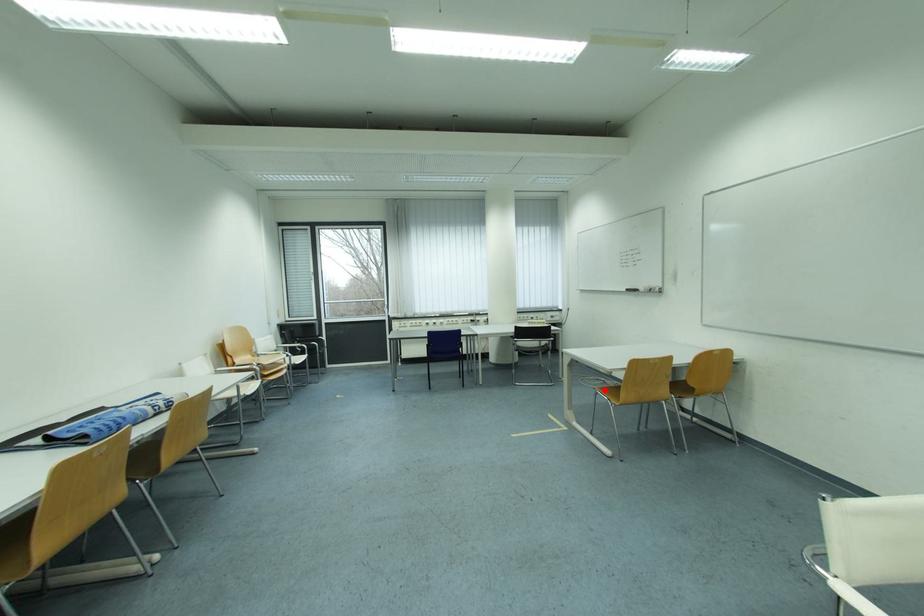
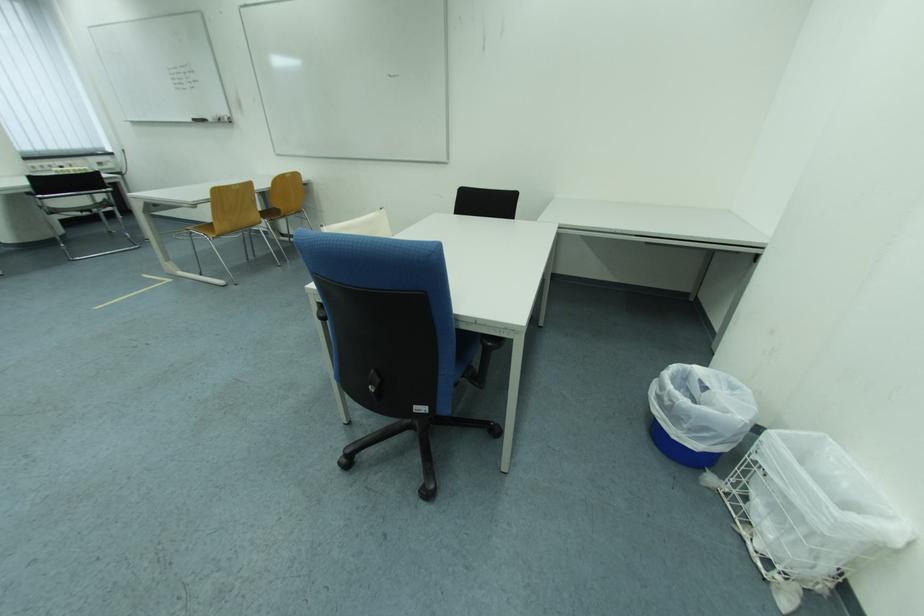
Where in the second image is the point corresponding to the highlighted location from the first image?

(197, 231)